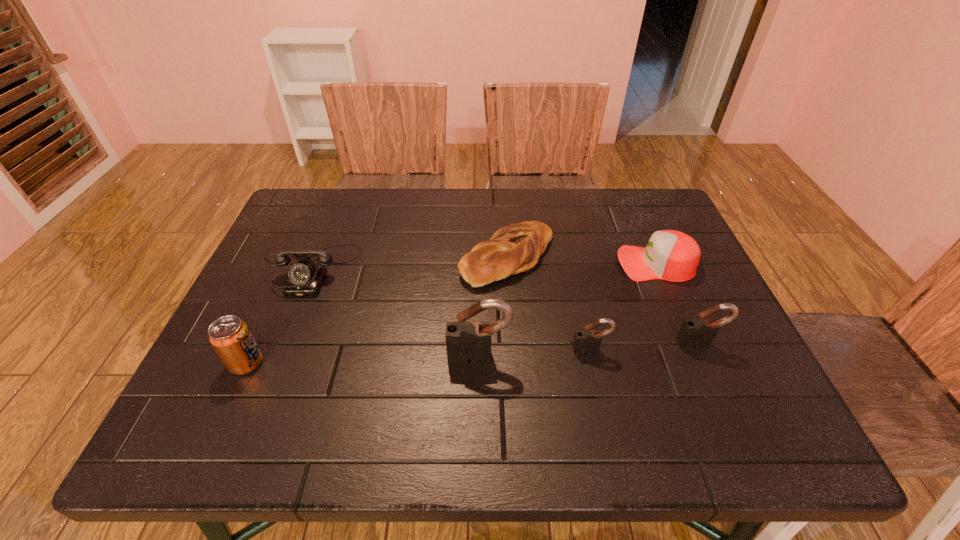
Locate an element on the screen. Image resolution: width=960 pixels, height=540 pixels. object that stands as the fourth closest to the tallest object is located at coordinates [x=670, y=255].

Locate an element on the screen. Image resolution: width=960 pixels, height=540 pixels. padlock that is the closest to the soda can is located at coordinates (468, 342).

Locate which padlock is the third closest to the telephone. Please provide its 2D coordinates. Your answer should be formatted as a tuple, i.e. [(x, y)], where the tuple contains the x and y coordinates of a point satisfying the conditions above.

[(699, 332)]

The image size is (960, 540). I want to click on free space that satisfies the following two spatial constraints: 1. on the front-facing side of the baseball cap; 2. with the keyhole on the front of the fifth object from left to right, so click(692, 349).

You are a GUI agent. You are given a task and a screenshot of the screen. Output one action in this format:
    pyautogui.click(x=<x>, y=<y>)
    Task: Click on the vacant area in the image that satisfies the following two spatial constraints: 1. on the front-facing side of the baseball cap; 2. with the keyhole on the front of the tallest object
    
    Given the screenshot: What is the action you would take?
    pyautogui.click(x=695, y=356)